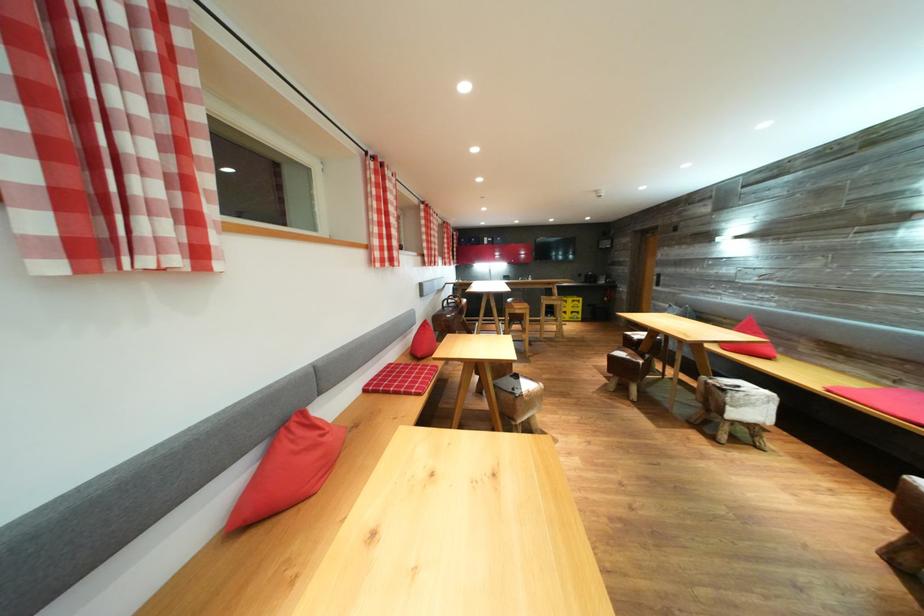
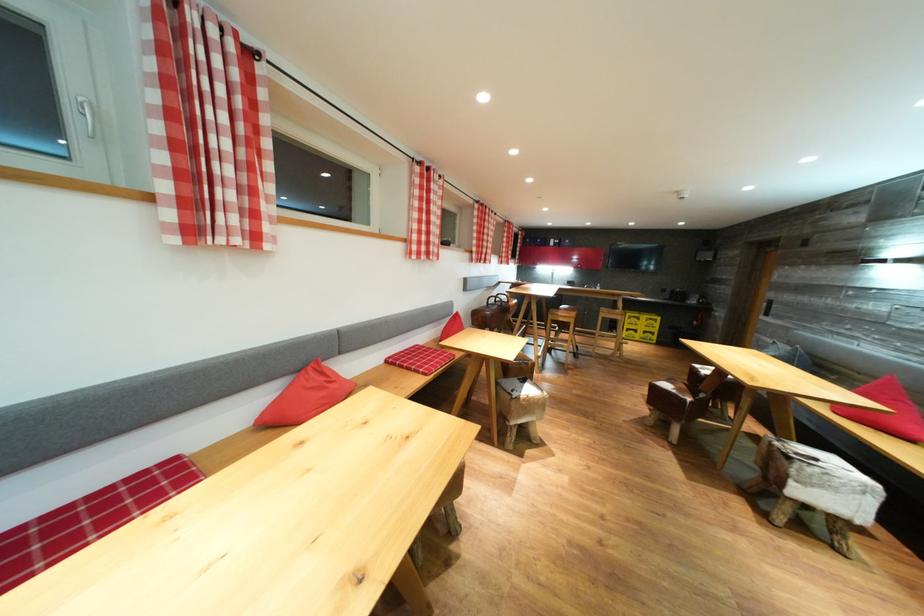
Find the pixel in the second image that matches [532,391] in the first image.

(536, 395)